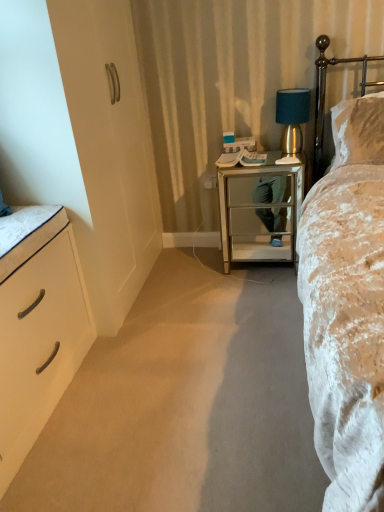
Image resolution: width=384 pixels, height=512 pixels. Describe the element at coordinates (325, 94) in the screenshot. I see `gold metallic headboard at upper right` at that location.

The width and height of the screenshot is (384, 512). I want to click on white matte chest of drawers at left, so click(39, 335).

Locate an element on the screen. teal fabric lampshade at right is located at coordinates coord(293,120).

Identify the location of gold metallic headboard at upper right. (325, 94).

Considering the relative sizes of teal fabric lampshade at right and gold metallic headboard at upper right in the image provided, is teal fabric lampshade at right shorter than gold metallic headboard at upper right?

Correct, teal fabric lampshade at right is not as tall as gold metallic headboard at upper right.

Considering their positions, is teal fabric lampshade at right located in front of or behind gold metallic headboard at upper right?

teal fabric lampshade at right is behind gold metallic headboard at upper right.

Looking at this image, between teal fabric lampshade at right and gold metallic headboard at upper right, which one has smaller width?

teal fabric lampshade at right is thinner.

In terms of size, does white matte chest of drawers at left appear bigger or smaller than silver mirrored nightstand at center?

In the image, white matte chest of drawers at left appears to be larger than silver mirrored nightstand at center.

Consider the image. Can you confirm if white matte chest of drawers at left is wider than silver mirrored nightstand at center?

Yes.

Could you tell me if white matte chest of drawers at left is turned towards silver mirrored nightstand at center?

No, white matte chest of drawers at left is not facing towards silver mirrored nightstand at center.

Is white matte chest of drawers at left not near silver mirrored nightstand at center?

white matte chest of drawers at left is far away from silver mirrored nightstand at center.

Based on the photo, between velvet beige bed at right and white matte chest of drawers at left, which one has less height?

white matte chest of drawers at left.

From the image's perspective, which one is positioned lower, velvet beige bed at right or white matte chest of drawers at left?

white matte chest of drawers at left, from the image's perspective.

Is velvet beige bed at right oriented towards white matte chest of drawers at left?

No, velvet beige bed at right is not aimed at white matte chest of drawers at left.

Considering the positions of points (52, 399) and (367, 318), is point (52, 399) farther from camera compared to point (367, 318)?

Yes, it is.

Which of these two, white matte chest of drawers at left or velvet beige bed at right, is smaller?

Smaller between the two is white matte chest of drawers at left.

Is white matte chest of drawers at left positioned with its back to velvet beige bed at right?

No.

From the picture: Which object is wider, white matte chest of drawers at left or velvet beige bed at right?

velvet beige bed at right is wider.

From a real-world perspective, is teal fabric lampshade at right beneath velvet beige bed at right?

No, from a real-world perspective, teal fabric lampshade at right is not below velvet beige bed at right.

Which object is closer to the camera taking this photo, teal fabric lampshade at right or velvet beige bed at right?

velvet beige bed at right is closer to the camera.

Could you tell me if teal fabric lampshade at right is facing velvet beige bed at right?

Yes, teal fabric lampshade at right is facing velvet beige bed at right.

Is silver mirrored nightstand at center aimed at white matte chest of drawers at left?

No, silver mirrored nightstand at center does not turn towards white matte chest of drawers at left.

Are silver mirrored nightstand at center and white matte chest of drawers at left making contact?

No, silver mirrored nightstand at center is not making contact with white matte chest of drawers at left.

Does silver mirrored nightstand at center have a lesser width compared to white matte chest of drawers at left?

Indeed, silver mirrored nightstand at center has a lesser width compared to white matte chest of drawers at left.

Does gold metallic headboard at upper right appear on the right side of teal fabric lampshade at right?

Correct, you'll find gold metallic headboard at upper right to the right of teal fabric lampshade at right.

Is gold metallic headboard at upper right positioned with its back to teal fabric lampshade at right?

gold metallic headboard at upper right does not have its back to teal fabric lampshade at right.

Which point is more distant from viewer, (334, 61) or (298, 106)?

The point (334, 61) is farther from the camera.

Looking at this image, does gold metallic headboard at upper right have a lesser height compared to teal fabric lampshade at right?

No.

Where is `headboard below the teal fabric lampshade at right (from the image's perspective)`? Image resolution: width=384 pixels, height=512 pixels. headboard below the teal fabric lampshade at right (from the image's perspective) is located at coordinates (325, 94).

Identify the location of nightstand that is above the white matte chest of drawers at left (from the image's perspective). (260, 211).

When comparing their distances from white matte chest of drawers at left, does gold metallic headboard at upper right or teal fabric lampshade at right seem further?

Based on the image, gold metallic headboard at upper right appears to be further to white matte chest of drawers at left.

Based on their spatial positions, is white matte chest of drawers at left or velvet beige bed at right closer to teal fabric lampshade at right?

velvet beige bed at right is positioned closer to the anchor teal fabric lampshade at right.

Based on their spatial positions, is gold metallic headboard at upper right or teal fabric lampshade at right further from velvet beige bed at right?

gold metallic headboard at upper right is positioned further to the anchor velvet beige bed at right.

Looking at the image, which one is located further to gold metallic headboard at upper right, velvet beige bed at right or silver mirrored nightstand at center?

The object further to gold metallic headboard at upper right is velvet beige bed at right.

Consider the image. Looking at the image, which one is located closer to silver mirrored nightstand at center, gold metallic headboard at upper right or teal fabric lampshade at right?

teal fabric lampshade at right.

From the image, which object appears to be nearer to silver mirrored nightstand at center, gold metallic headboard at upper right or white matte chest of drawers at left?

Based on the image, gold metallic headboard at upper right appears to be nearer to silver mirrored nightstand at center.

Considering their positions, is teal fabric lampshade at right positioned further to white matte chest of drawers at left than gold metallic headboard at upper right?

The object further to white matte chest of drawers at left is gold metallic headboard at upper right.

When comparing their distances from white matte chest of drawers at left, does gold metallic headboard at upper right or silver mirrored nightstand at center seem further?

Among the two, gold metallic headboard at upper right is located further to white matte chest of drawers at left.

Locate an element on the screen. The height and width of the screenshot is (512, 384). headboard between velvet beige bed at right and teal fabric lampshade at right in the front-back direction is located at coordinates (325, 94).

At what (x,y) coordinates should I click in order to perform the action: click on headboard between velvet beige bed at right and silver mirrored nightstand at center from front to back. Please return your answer as a coordinate pair (x, y). Looking at the image, I should click on (325, 94).

Locate an element on the screen. The image size is (384, 512). the chest of drawers positioned between velvet beige bed at right and teal fabric lampshade at right from near to far is located at coordinates (39, 335).

I want to click on nightstand between velvet beige bed at right and teal fabric lampshade at right in the front-back direction, so click(x=260, y=211).